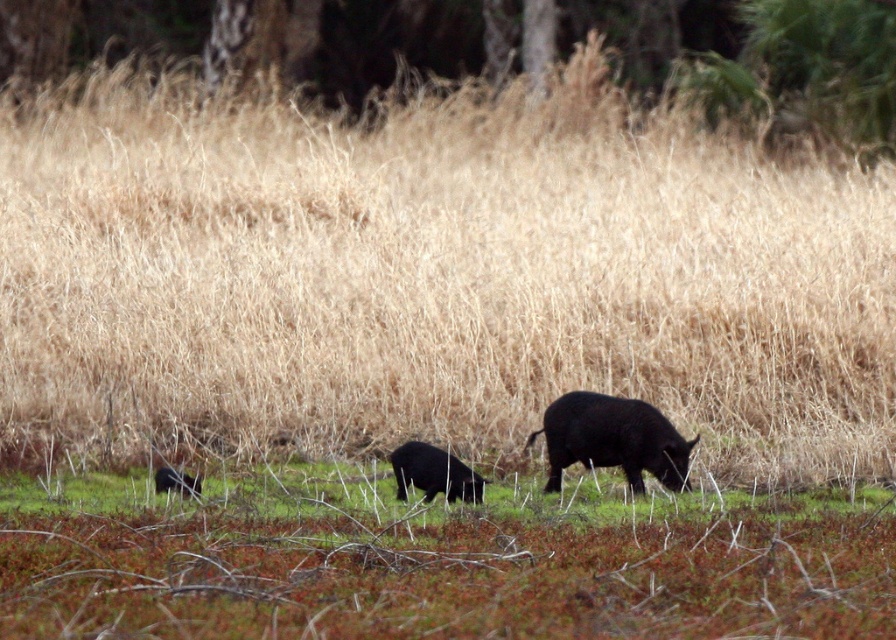
Can you confirm if shiny black boar at center is positioned below shiny black bear at lower left?

No, shiny black boar at center is not below shiny black bear at lower left.

Does shiny black boar at center lie in front of shiny black bear at lower left?

Yes.

Does point (675, 444) lie behind point (162, 481)?

No, it is not.

You are a GUI agent. You are given a task and a screenshot of the screen. Output one action in this format:
    pyautogui.click(x=<x>, y=<y>)
    Task: Click on the shiny black boar at center
    This screenshot has width=896, height=640.
    Given the screenshot: What is the action you would take?
    pyautogui.click(x=613, y=440)

Measure the distance between shiny black boar at center and camera.

shiny black boar at center and camera are 9.07 meters apart from each other.

Between point (677, 461) and point (428, 492), which one is positioned behind?

The point (428, 492) is behind.

The image size is (896, 640). I want to click on shiny black boar at center, so click(613, 440).

The height and width of the screenshot is (640, 896). I want to click on black matte pig at center, so click(x=434, y=474).